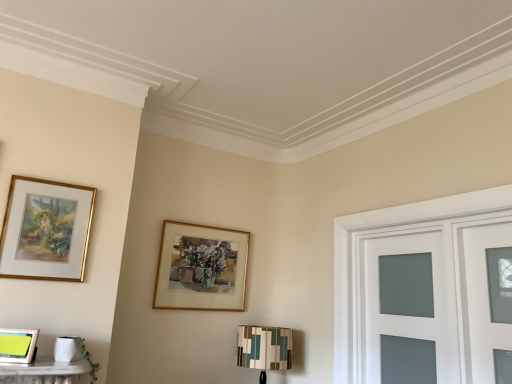
Question: Does gold-framed picture at upper center, the 1th picture frame when ordered from back to front, have a lesser height compared to gold-framed painting at upper left, which ranks as the second picture frame in left-to-right order?

Choices:
 (A) yes
 (B) no

Answer: (B)

Question: Can you confirm if gold-framed picture at upper center, the 1th picture frame when ordered from back to front, is positioned to the left of gold-framed painting at upper left, which ranks as the second picture frame in left-to-right order?

Choices:
 (A) yes
 (B) no

Answer: (B)

Question: Could you tell me if gold-framed picture at upper center, the 1th picture frame positioned from the right, is facing gold-framed painting at upper left, which ranks as the second picture frame in left-to-right order?

Choices:
 (A) no
 (B) yes

Answer: (A)

Question: From a real-world perspective, is gold-framed picture at upper center, which is counted as the 3th picture frame, starting from the left, beneath gold-framed painting at upper left, the second picture frame positioned from the right?

Choices:
 (A) yes
 (B) no

Answer: (A)

Question: Is gold-framed picture at upper center, which is counted as the 3th picture frame, starting from the left, beside gold-framed painting at upper left, the second picture frame positioned from the right?

Choices:
 (A) yes
 (B) no

Answer: (B)

Question: From the image's perspective, would you say gold-framed picture at upper center, the 1th picture frame positioned from the right, is positioned over gold-framed painting at upper left, the second picture frame viewed from the back?

Choices:
 (A) yes
 (B) no

Answer: (B)

Question: Can gold-framed picture at upper center, the 1th picture frame positioned from the right, be found inside matte glass door at right?

Choices:
 (A) no
 (B) yes

Answer: (A)

Question: From a real-world perspective, is matte glass door at right physically below gold-framed picture at upper center, the 1th picture frame when ordered from back to front?

Choices:
 (A) yes
 (B) no

Answer: (A)

Question: Does matte glass door at right lie behind gold-framed picture at upper center, placed as the third picture frame when sorted from front to back?

Choices:
 (A) no
 (B) yes

Answer: (A)

Question: Considering the relative sizes of matte glass door at right and gold-framed picture at upper center, placed as the third picture frame when sorted from front to back, in the image provided, is matte glass door at right taller than gold-framed picture at upper center, placed as the third picture frame when sorted from front to back,?

Choices:
 (A) no
 (B) yes

Answer: (B)

Question: Can you confirm if matte glass door at right is smaller than gold-framed picture at upper center, placed as the third picture frame when sorted from front to back?

Choices:
 (A) no
 (B) yes

Answer: (A)

Question: Is gold-framed picture at upper center, placed as the third picture frame when sorted from front to back, at the back of matte glass door at right?

Choices:
 (A) yes
 (B) no

Answer: (B)

Question: Is gold-framed picture at upper center, the 1th picture frame positioned from the right, not inside metallic silver picture frame at lower left, positioned as the third picture frame in back-to-front order?

Choices:
 (A) yes
 (B) no

Answer: (A)